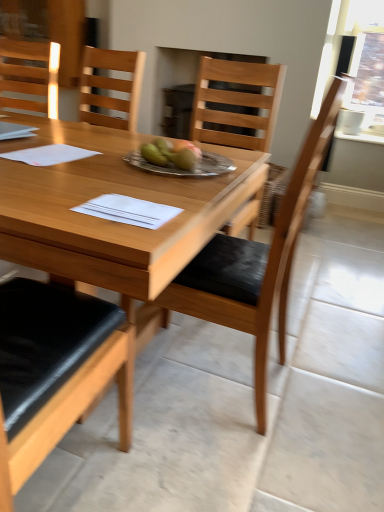
This screenshot has width=384, height=512. I want to click on vacant space underneath wooden chair at center, the first chair ordered from the bottom (from a real-world perspective), so click(229, 391).